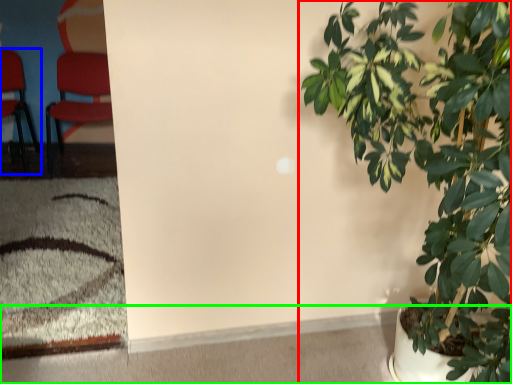
Question: Estimate the real-world distances between objects in this image. Which object is farther from houseplant (highlighted by a red box), chair (highlighted by a blue box) or concrete (highlighted by a green box)?

Choices:
 (A) chair
 (B) concrete

Answer: (A)